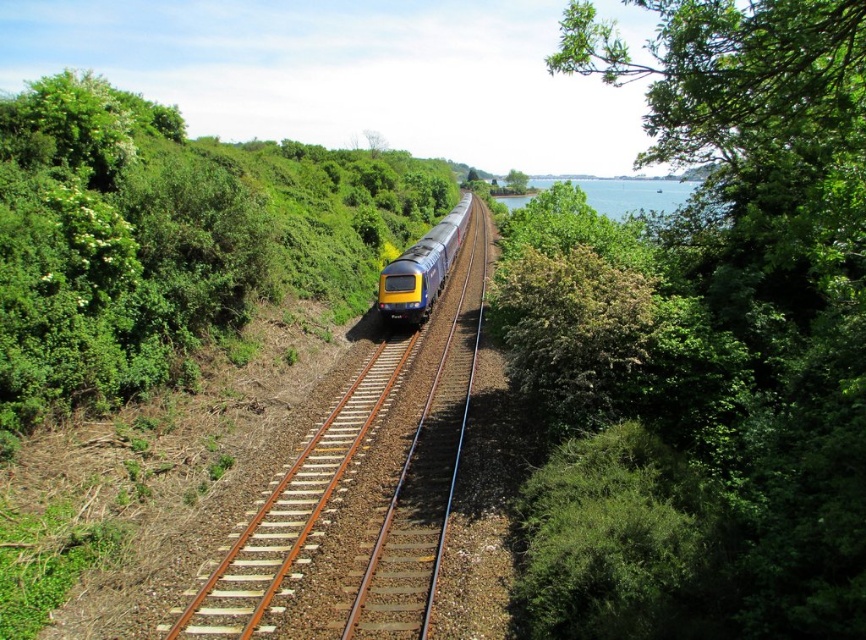
Question: Does yellowmetallictrain at center appear on the left side of green leafy tree at upper center?

Choices:
 (A) no
 (B) yes

Answer: (B)

Question: Which object is positioned farthest from the green leafy tree at right?

Choices:
 (A) yellowmetallictrain at center
 (B) blue water at upper center

Answer: (B)

Question: Does yellowmetallictrain at center appear on the left side of blue water at upper center?

Choices:
 (A) no
 (B) yes

Answer: (B)

Question: Which object appears closest to the camera in this image?

Choices:
 (A) yellowmetallictrain at center
 (B) blue water at upper center

Answer: (A)

Question: Is blue water at upper center in front of green leafy tree at upper center?

Choices:
 (A) no
 (B) yes

Answer: (B)

Question: Estimate the real-world distances between objects in this image. Which object is farther from the green leafy tree at right?

Choices:
 (A) green leafy tree at upper center
 (B) yellowmetallictrain at center
 (C) blue water at upper center
 (D) blue metallic train at center

Answer: (A)